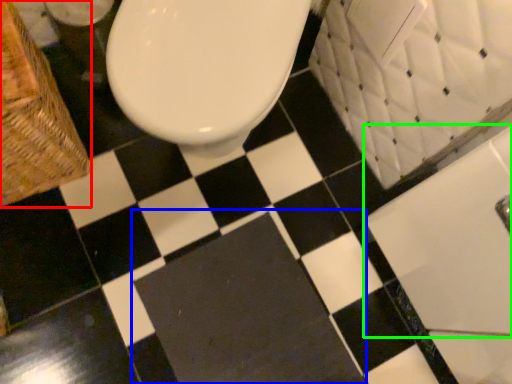
Question: Which object is positioned farthest from basket (highlighted by a red box)? Select from bath mat (highlighted by a blue box) and bath (highlighted by a green box).

Choices:
 (A) bath mat
 (B) bath

Answer: (B)